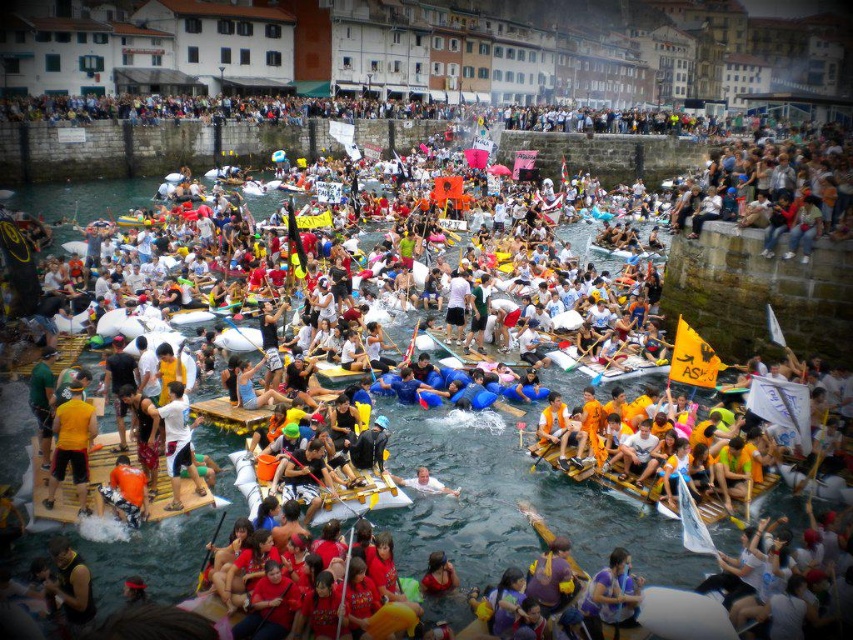
Question: Observing the image, what is the correct spatial positioning of yellow fabric shirt at center in reference to orange life vest at center?

Choices:
 (A) below
 (B) above

Answer: (B)

Question: Which point is closer to the camera?

Choices:
 (A) (590, 362)
 (B) (177, 451)

Answer: (B)

Question: Does white matte shirt at center appear on the right side of white fabric raft at center?

Choices:
 (A) no
 (B) yes

Answer: (A)

Question: Which of the following is the farthest from the observer?

Choices:
 (A) white fabric raft at center
 (B) white matte shirt at center
 (C) yellow foam paddle at center

Answer: (C)

Question: Which of these objects is positioned closest to the wooden paddle at center?

Choices:
 (A) yellow fabric shirt at center
 (B) orange life vest at center
 (C) white matte shirt at center

Answer: (C)

Question: Is white matte shirt at center to the right of wooden paddle at center from the viewer's perspective?

Choices:
 (A) no
 (B) yes

Answer: (A)